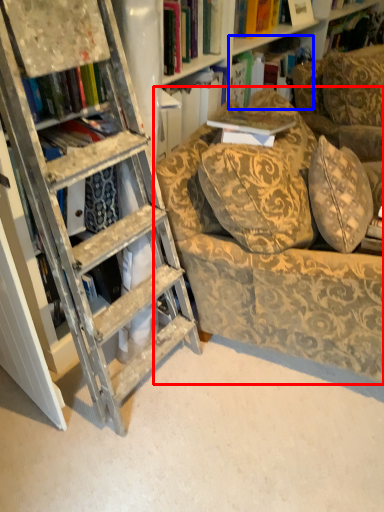
Question: Which of the following is the closest to the observer, chair (highlighted by a red box) or book (highlighted by a blue box)?

Choices:
 (A) chair
 (B) book

Answer: (A)